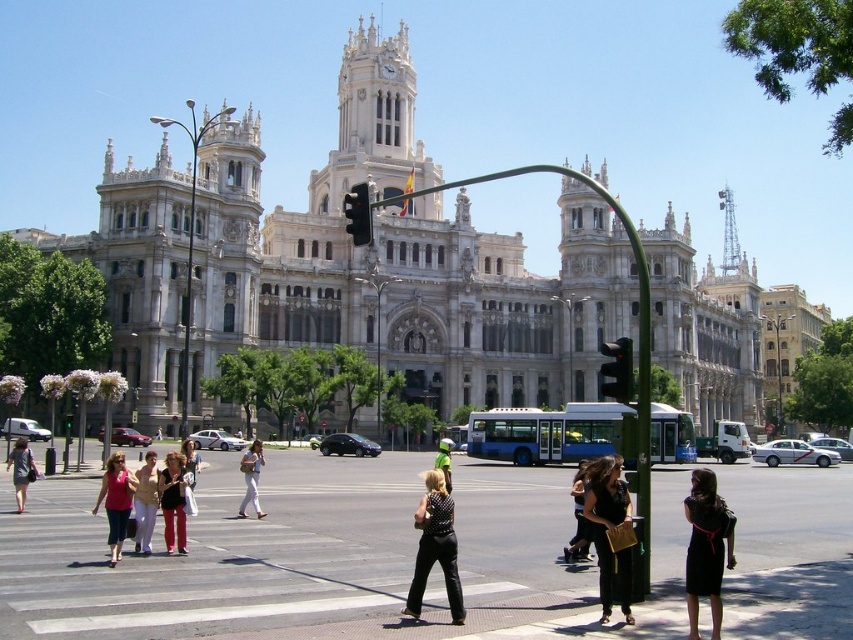
You are a pedestrian standing at the edge of the crosswalk. You see a person wearing light beige pants at center and another wearing a green reflective vest at center. Which one is closer to your left side?

The light beige pants at center is to the left of green reflective vest at center, so the person wearing light beige pants at center is closer to your left side.

You are a photographer standing at the pedestrian crossing, wanting to capture both the light beige pants at center and the black dress at center in a single frame. Based on their widths, which one might require you to adjust your camera angle to ensure both fit in the shot?

The light beige pants at center might be wider than the black dress at center, so adjusting the camera angle to accommodate its width would be necessary to include both in the frame.

You are a fashion designer attending an outdoor event near the grand ornate building with classical architectural features. You notice a black leather dress at center. Can you determine its exact position relative to the traffic light pole in the crosswalk?

The black leather dress at center is located at point (x=608, y=531), which places it near the traffic light pole in the crosswalk.